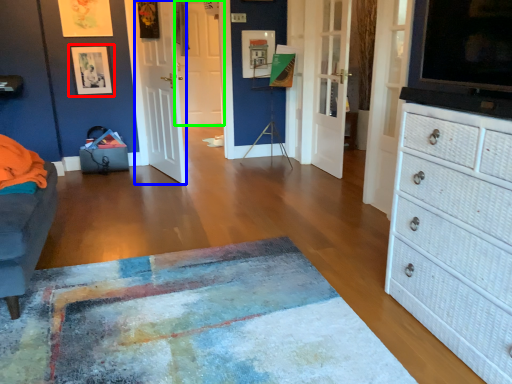
Question: Based on their relative distances, which object is nearer to picture frame (highlighted by a red box)? Choose from door (highlighted by a blue box) and door (highlighted by a green box).

Choices:
 (A) door
 (B) door

Answer: (A)